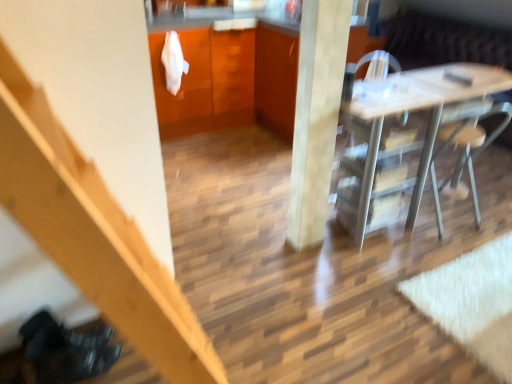
Question: Considering the relative sizes of smooth light wood pillar at center and wooden stairs at left in the image provided, is smooth light wood pillar at center taller than wooden stairs at left?

Choices:
 (A) no
 (B) yes

Answer: (A)

Question: Is smooth light wood pillar at center outside wooden stairs at left?

Choices:
 (A) no
 (B) yes

Answer: (B)

Question: Is smooth light wood pillar at center further to the viewer compared to wooden stairs at left?

Choices:
 (A) yes
 (B) no

Answer: (A)

Question: From a real-world perspective, is smooth light wood pillar at center located beneath wooden stairs at left?

Choices:
 (A) no
 (B) yes

Answer: (B)

Question: Is smooth light wood pillar at center to the left of wooden stairs at left from the viewer's perspective?

Choices:
 (A) no
 (B) yes

Answer: (A)

Question: Is point (10, 92) closer or farther from the camera than point (263, 51)?

Choices:
 (A) farther
 (B) closer

Answer: (B)

Question: In terms of height, does wooden stairs at left look taller or shorter compared to glossy wood cabinetry at center, the first cabinetry from the left?

Choices:
 (A) tall
 (B) short

Answer: (A)

Question: From the image's perspective, is wooden stairs at left located above or below glossy wood cabinetry at center, the first cabinetry from the left?

Choices:
 (A) below
 (B) above

Answer: (A)

Question: Looking at their shapes, would you say wooden stairs at left is wider or thinner than glossy wood cabinetry at center, the first cabinetry from the left?

Choices:
 (A) thin
 (B) wide

Answer: (A)

Question: In terms of width, does glossy wood cabinetry at center, the first cabinetry from the left, look wider or thinner when compared to wooden cabinet at center, which appears as the 1th cabinetry when viewed from the right?

Choices:
 (A) thin
 (B) wide

Answer: (B)

Question: Is glossy wood cabinetry at center, the second cabinetry in the right-to-left sequence, inside or outside of wooden cabinet at center, which appears as the 1th cabinetry when viewed from the right?

Choices:
 (A) outside
 (B) inside

Answer: (B)

Question: Is point (160, 135) closer or farther from the camera than point (266, 46)?

Choices:
 (A) farther
 (B) closer

Answer: (A)

Question: Considering the positions of glossy wood cabinetry at center, the second cabinetry in the right-to-left sequence, and wooden cabinet at center, which appears as the 1th cabinetry when viewed from the right, in the image, is glossy wood cabinetry at center, the second cabinetry in the right-to-left sequence, taller or shorter than wooden cabinet at center, which appears as the 1th cabinetry when viewed from the right,?

Choices:
 (A) short
 (B) tall

Answer: (B)

Question: Choose the correct answer: Is glossy wood cabinetry at center, the second cabinetry in the right-to-left sequence, inside metallic silver chair at right or outside it?

Choices:
 (A) outside
 (B) inside

Answer: (A)

Question: From the image's perspective, is glossy wood cabinetry at center, the first cabinetry from the left, above or below metallic silver chair at right?

Choices:
 (A) above
 (B) below

Answer: (A)